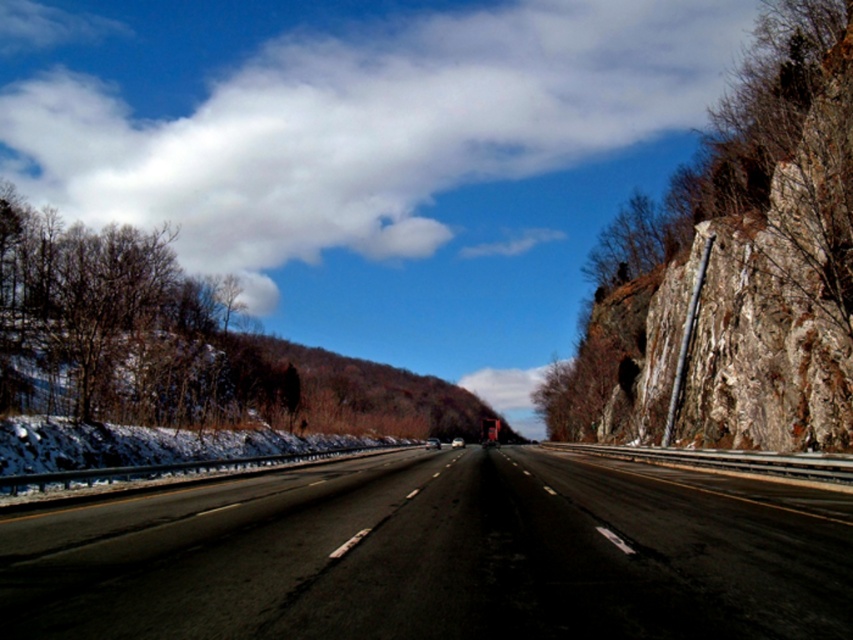
Consider the image. You are driving a car and want to avoid hitting the bare wood trees at left. According to the scene, where should you keep your car positioned on the black asphalt highway at center to stay safe?

The black asphalt highway at center is located below the bare wood trees at left, so to stay safe, you should keep your car positioned on the right side of the black asphalt highway at center away from the trees.

You are standing at the edge of the black asphalt highway at center. You want to walk to the guardrail on the left side. The guardrail is 3 meters away from the highway. Can you safely walk to the guardrail without stepping onto the road?

The distance between you and the camera is 5.28 meters, but the guardrail is only 3 meters away from the highway. Since the guardrail is closer than your current position, you can safely walk to it without stepping onto the road.

You are a photographer planning to capture the black asphalt highway at center and the bare wood trees at left in a single shot. Considering their heights, which object should you position closer to the camera to ensure both are fully visible in the frame?

The black asphalt highway at center has a lesser height compared to the bare wood trees at left. To ensure both are fully visible in the frame, position the black asphalt highway at center closer to the camera since it is shorter and the trees are taller, allowing their full height to be captured without cropping.